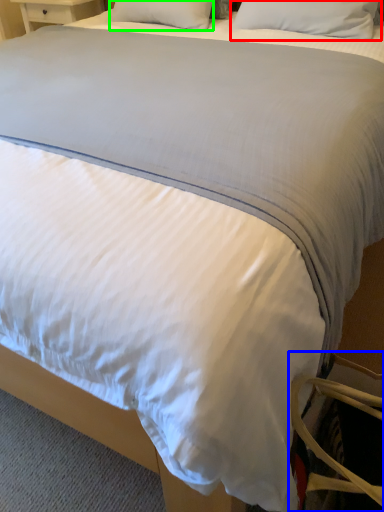
Question: Based on their relative distances, which object is nearer to pillow (highlighted by a red box)? Choose from swivel chair (highlighted by a blue box) and pillow (highlighted by a green box).

Choices:
 (A) swivel chair
 (B) pillow

Answer: (B)